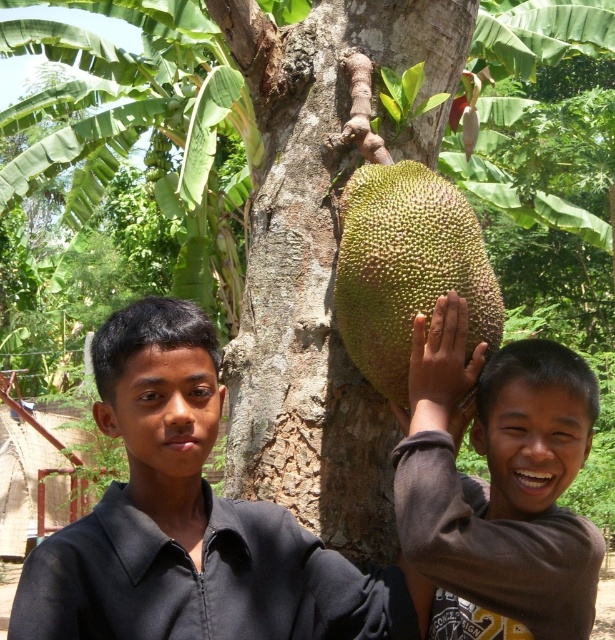
Question: Is brown matte jackfruit at center below green spiky jackfruit at center?

Choices:
 (A) no
 (B) yes

Answer: (B)

Question: Can you confirm if black matte shirt at left is positioned to the right of green spiky jackfruit at center?

Choices:
 (A) yes
 (B) no

Answer: (B)

Question: Which is nearer to the black matte shirt at left?

Choices:
 (A) brown matte jackfruit at center
 (B) green spiky jackfruit at center

Answer: (A)

Question: Which point is closer to the camera?

Choices:
 (A) (204, 346)
 (B) (469, 234)
 (C) (510, 424)

Answer: (C)

Question: Does brown matte jackfruit at center appear over green spiky jackfruit at center?

Choices:
 (A) yes
 (B) no

Answer: (B)

Question: Which of the following is the closest to the observer?

Choices:
 (A) brown matte jackfruit at center
 (B) black matte shirt at left
 (C) green spiky jackfruit at center

Answer: (B)